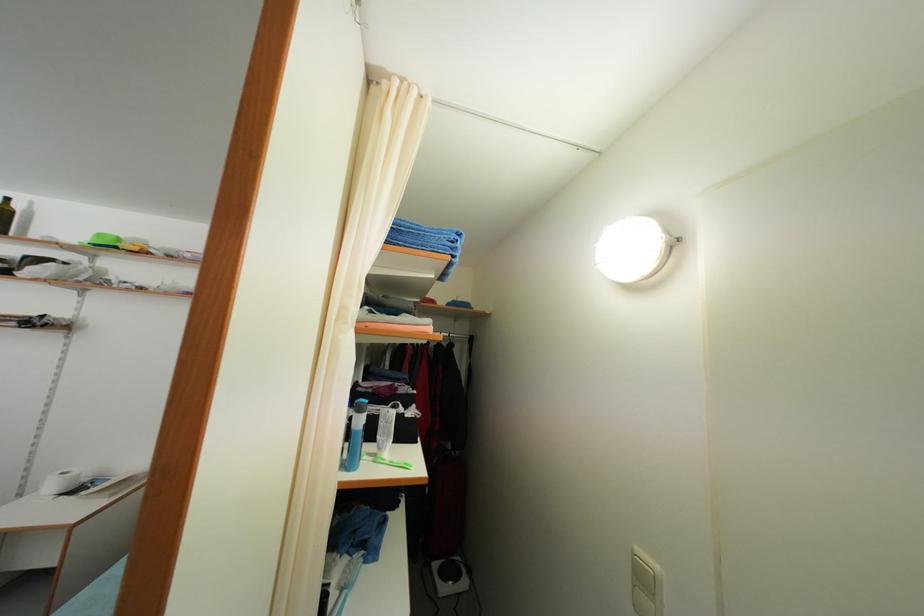
Which object does [356,435] point to?

It refers to a dark glass bottle.